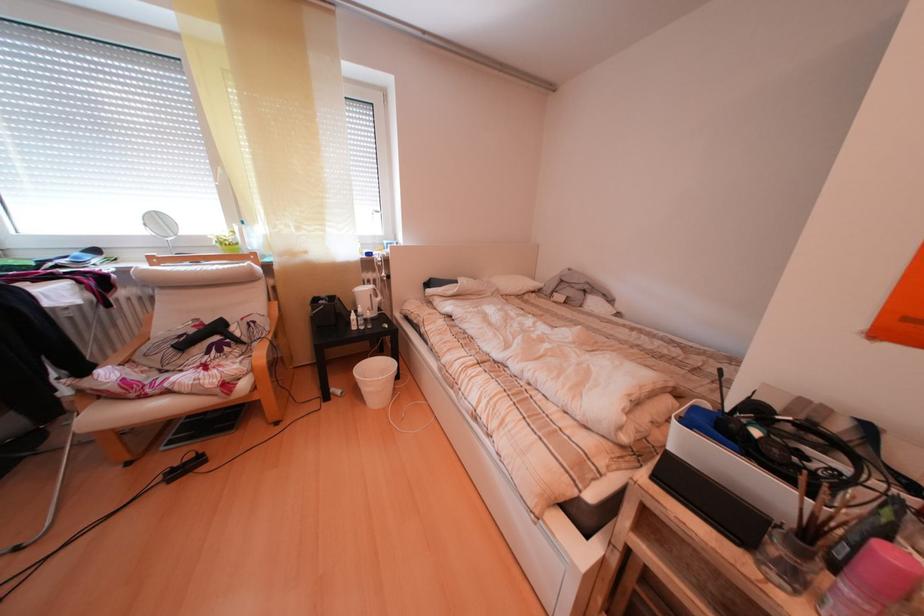
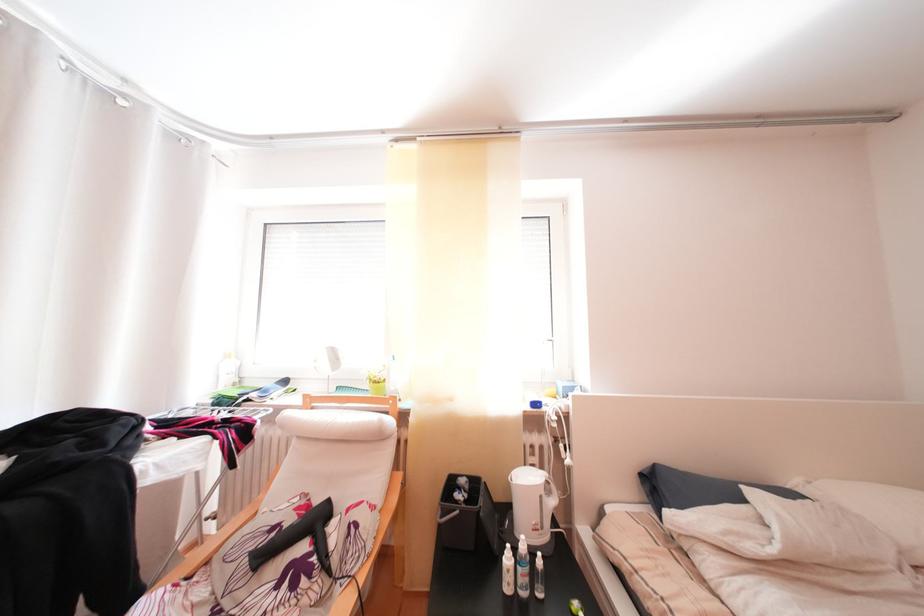
The images are taken continuously from a first-person perspective. In which direction is your viewpoint rotating?

The camera's rotation is toward left-up.